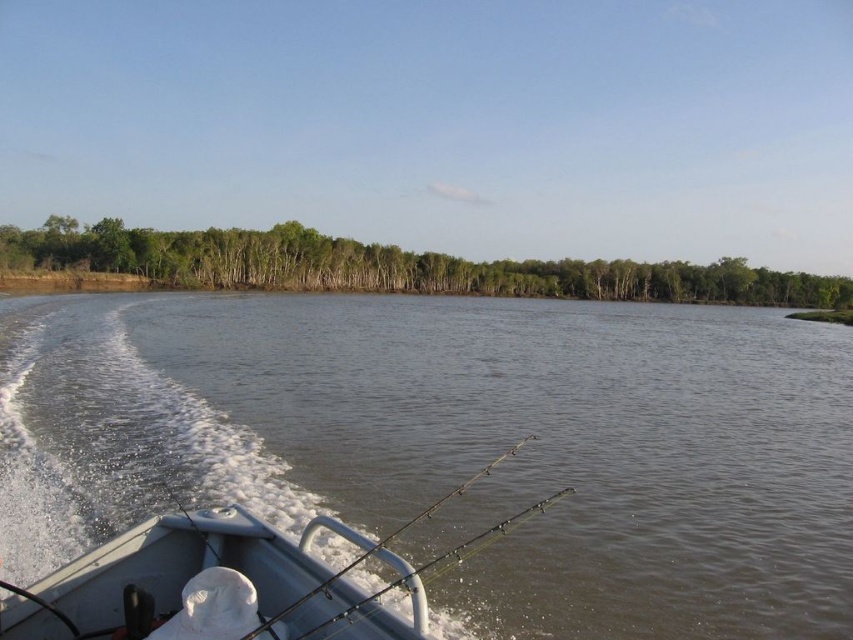
Question: Can you confirm if brown water at center is wider than green leafy trees at upper center?

Choices:
 (A) no
 (B) yes

Answer: (A)

Question: Considering the relative positions of green leafy trees at upper center and green metallic fishing pole at center in the image provided, where is green leafy trees at upper center located with respect to green metallic fishing pole at center?

Choices:
 (A) right
 (B) left

Answer: (A)

Question: Considering the real-world distances, which object is farthest from the brown water at center?

Choices:
 (A) green leafy trees at upper center
 (B) green metallic fishing pole at center

Answer: (A)

Question: Is green leafy trees at upper center closer to camera compared to green metallic fishing pole at center?

Choices:
 (A) yes
 (B) no

Answer: (B)

Question: Which object is the closest to the green leafy trees at upper center?

Choices:
 (A) brown water at center
 (B) green metallic fishing pole at center

Answer: (A)

Question: Which point is farther to the camera?

Choices:
 (A) (355, 560)
 (B) (634, 435)

Answer: (B)